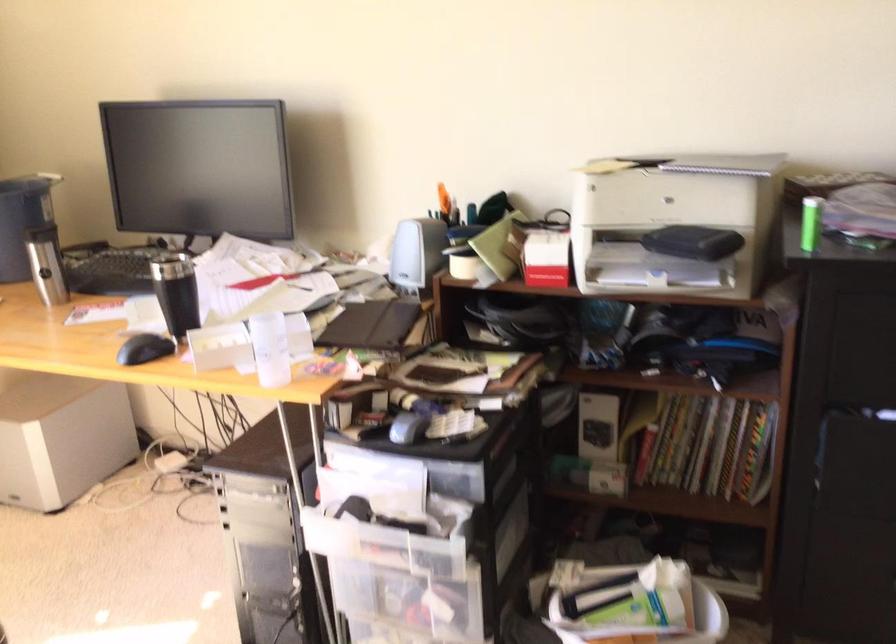
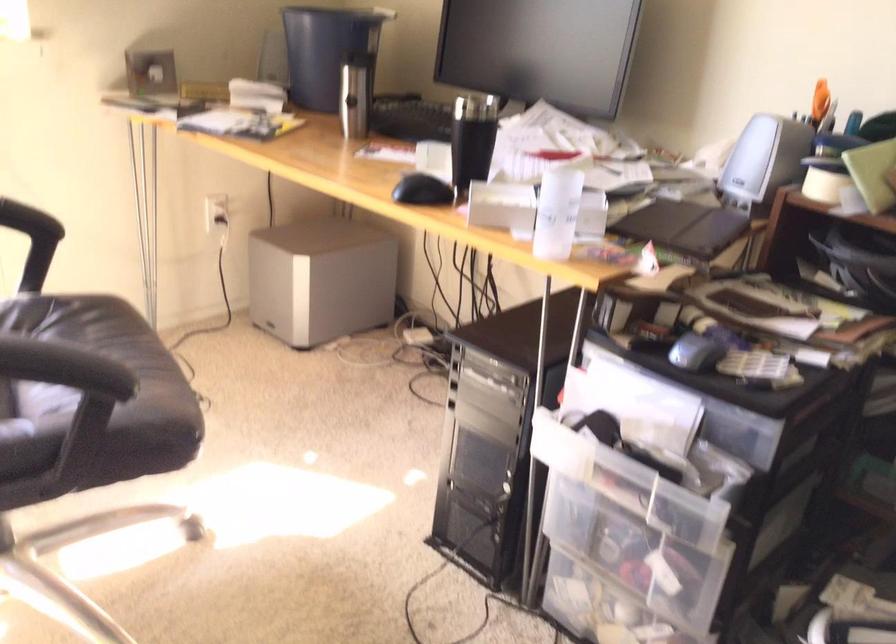
Question: What movement of the cameraman would produce the second image?

Choices:
 (A) Left
 (B) Right
 (C) Forward
 (D) Backward

Answer: (C)